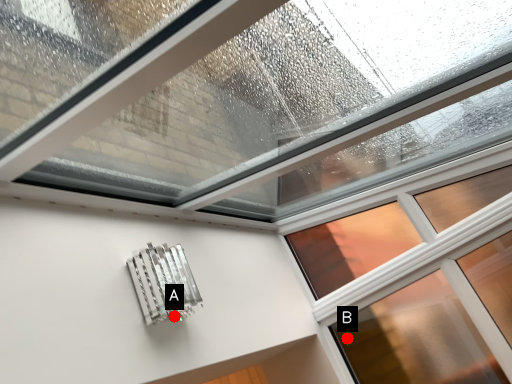
Question: Two points are circled on the image, labeled by A and B beside each circle. Among these points, which one is nearest to the camera?

Choices:
 (A) A is closer
 (B) B is closer

Answer: (A)